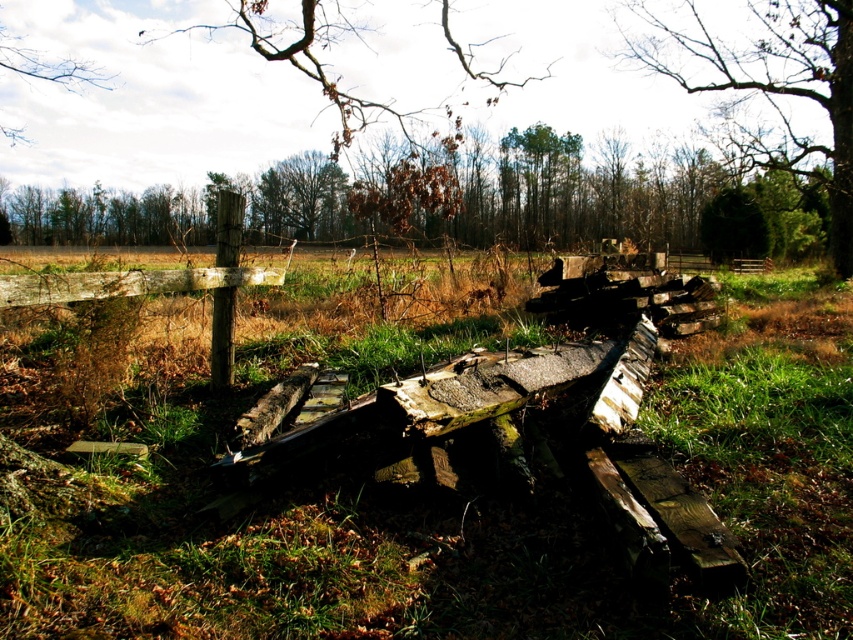
From the picture: You are a gardener who wants to mow the green grass at center. However, there is a brown wood tree at upper left nearby. Considering their heights, which one is taller?

The green grass at center is much taller than the brown wood tree at upper left, so the grass is taller.

You are an environmental inspector assessing the scene. You notice the bare wood tree at upper center and the brown wood tree at upper left. Which tree is closer to the ground where the dilapidated wooden structure lies?

The bare wood tree at upper center is positioned under the brown wood tree at upper left, meaning it is closer to the ground with the dilapidated wooden structure.

In the scene shown: You are an observer looking at the rural scene. You notice two trees in the upper part of the image. Which tree is taller between the bare wood tree at upper center and the brown wood tree at upper left?

The bare wood tree at upper center is much taller than the brown wood tree at upper left.